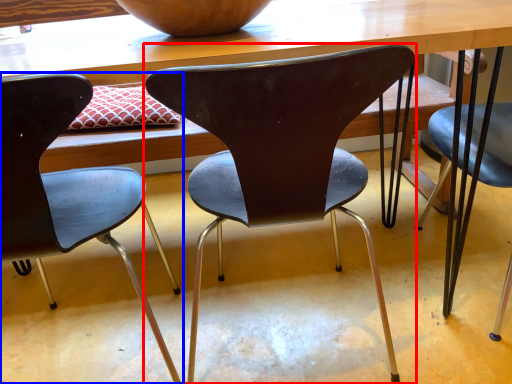
Question: Which object is further to the camera taking this photo, chair (highlighted by a red box) or chair (highlighted by a blue box)?

Choices:
 (A) chair
 (B) chair

Answer: (A)